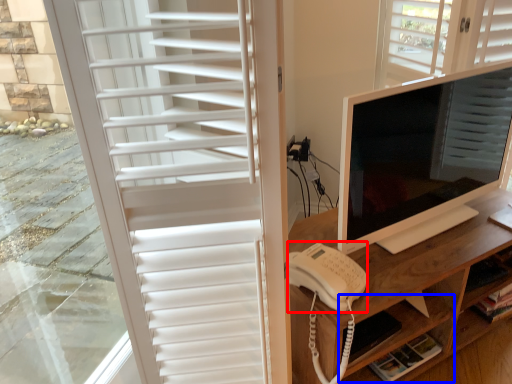
Question: Which of the following is the farthest to the observer, open (highlighted by a red box) or shelf (highlighted by a blue box)?

Choices:
 (A) open
 (B) shelf

Answer: (B)